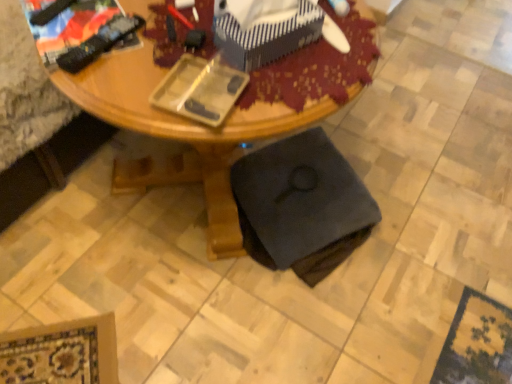
What is the approximate height of blue striped fabric box at upper center?

blue striped fabric box at upper center is 5.97 inches in height.

Where is `wooden desk at center`? This screenshot has width=512, height=384. wooden desk at center is located at coordinates (179, 135).

Is blue striped fabric box at upper center facing towards wooden desk at center?

No, blue striped fabric box at upper center is not facing towards wooden desk at center.

Is point (258, 21) closer or farther from the camera than point (231, 155)?

Clearly, point (258, 21) is closer to the camera than point (231, 155).

Which is more to the right, blue striped fabric box at upper center or wooden desk at center?

blue striped fabric box at upper center is more to the right.

From a real-world perspective, which object stands above the other?

In real-world perspective, blue striped fabric box at upper center is above.

Can you confirm if wooden desk at center is taller than blue striped fabric box at upper center?

Correct, wooden desk at center is much taller as blue striped fabric box at upper center.

How many degrees apart are the facing directions of wooden desk at center and blue striped fabric box at upper center?

76.1 degrees separate the facing orientations of wooden desk at center and blue striped fabric box at upper center.

Is the surface of wooden desk at center in direct contact with blue striped fabric box at upper center?

No, wooden desk at center is not next to blue striped fabric box at upper center.

In terms of width, does wooden desk at center look wider or thinner when compared to blue striped fabric box at upper center?

wooden desk at center is wider than blue striped fabric box at upper center.

Is blue striped fabric box at upper center placed right next to black fabric swivel chair at lower center?

No, blue striped fabric box at upper center is not making contact with black fabric swivel chair at lower center.

What's the angular difference between blue striped fabric box at upper center and black fabric swivel chair at lower center's facing directions?

The angle between the facing direction of blue striped fabric box at upper center and the facing direction of black fabric swivel chair at lower center is 99.1 degrees.

Considering the sizes of blue striped fabric box at upper center and black fabric swivel chair at lower center in the image, is blue striped fabric box at upper center bigger or smaller than black fabric swivel chair at lower center?

blue striped fabric box at upper center is smaller than black fabric swivel chair at lower center.

Image resolution: width=512 pixels, height=384 pixels. What are the coordinates of `box that is above the black fabric swivel chair at lower center (from a real-world perspective)` in the screenshot? It's located at (264, 30).

Is wooden desk at center positioned with its back to black fabric swivel chair at lower center?

No, black fabric swivel chair at lower center is not at the back of wooden desk at center.

From a real-world perspective, is wooden desk at center physically above black fabric swivel chair at lower center?

Yes, from a real-world perspective, wooden desk at center is on top of black fabric swivel chair at lower center.

Considering the relative sizes of wooden desk at center and black fabric swivel chair at lower center in the image provided, is wooden desk at center smaller than black fabric swivel chair at lower center?

Actually, wooden desk at center might be larger than black fabric swivel chair at lower center.

I want to click on desk located above the black fabric swivel chair at lower center (from the image's perspective), so click(x=179, y=135).

Is black fabric swivel chair at lower center located outside wooden desk at center?

No, most part of black fabric swivel chair at lower center lies within wooden desk at center.

Is point (332, 250) behind point (212, 258)?

Yes, it is.

In the scene shown: Is black fabric swivel chair at lower center oriented away from wooden desk at center?

Yes, black fabric swivel chair at lower center's orientation is away from wooden desk at center.

Which object is thinner, black fabric swivel chair at lower center or wooden desk at center?

With smaller width is black fabric swivel chair at lower center.

Is black fabric swivel chair at lower center positioned before blue striped fabric box at upper center?

No, it is behind blue striped fabric box at upper center.

Is black fabric swivel chair at lower center next to blue striped fabric box at upper center?

black fabric swivel chair at lower center and blue striped fabric box at upper center are not in contact.

Consider the image. Considering the relative sizes of black fabric swivel chair at lower center and blue striped fabric box at upper center in the image provided, is black fabric swivel chair at lower center smaller than blue striped fabric box at upper center?

No, black fabric swivel chair at lower center is not smaller than blue striped fabric box at upper center.

Considering the relative sizes of black fabric swivel chair at lower center and blue striped fabric box at upper center in the image provided, is black fabric swivel chair at lower center wider than blue striped fabric box at upper center?

Yes.

Image resolution: width=512 pixels, height=384 pixels. I want to click on desk that appears on the left of blue striped fabric box at upper center, so click(179, 135).

You are a GUI agent. You are given a task and a screenshot of the screen. Output one action in this format:
    pyautogui.click(x=<x>, y=<y>)
    Task: Click on the desk below the blue striped fabric box at upper center (from the image's perspective)
    
    Given the screenshot: What is the action you would take?
    pyautogui.click(x=179, y=135)

Looking at the image, which one is located closer to blue striped fabric box at upper center, wooden desk at center or black fabric swivel chair at lower center?

wooden desk at center.

Considering their positions, is black fabric swivel chair at lower center positioned closer to blue striped fabric box at upper center than wooden desk at center?

Among the two, wooden desk at center is located nearer to blue striped fabric box at upper center.

Which object lies further to the anchor point wooden desk at center, blue striped fabric box at upper center or black fabric swivel chair at lower center?

The object further to wooden desk at center is blue striped fabric box at upper center.

When comparing their distances from black fabric swivel chair at lower center, does blue striped fabric box at upper center or wooden desk at center seem further?

Among the two, blue striped fabric box at upper center is located further to black fabric swivel chair at lower center.

Estimate the real-world distances between objects in this image. Which object is further from wooden desk at center, black fabric swivel chair at lower center or blue striped fabric box at upper center?

blue striped fabric box at upper center is positioned further to the anchor wooden desk at center.

When comparing their distances from black fabric swivel chair at lower center, does wooden desk at center or blue striped fabric box at upper center seem further?

blue striped fabric box at upper center.

Where is `box between wooden desk at center and black fabric swivel chair at lower center from front to back`? box between wooden desk at center and black fabric swivel chair at lower center from front to back is located at coordinates pos(264,30).